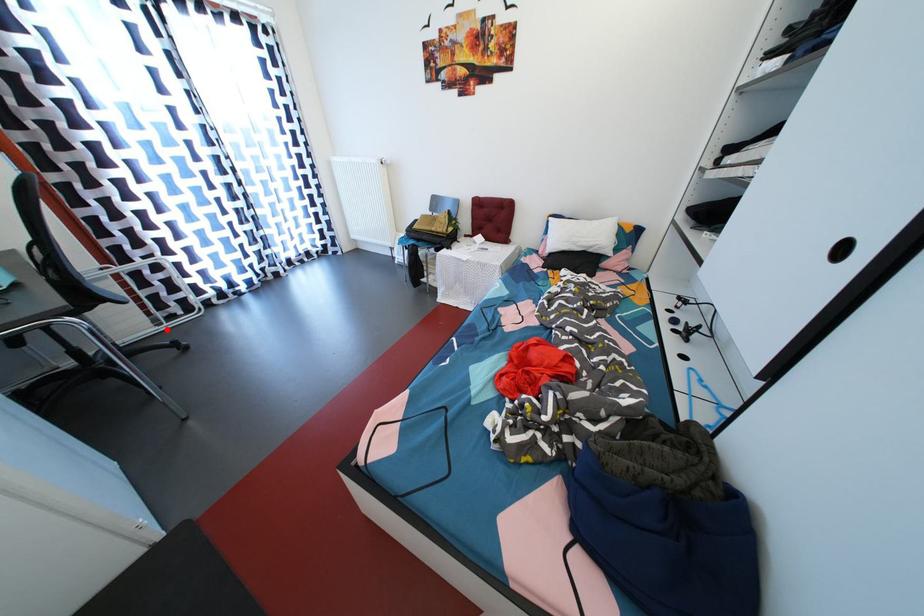
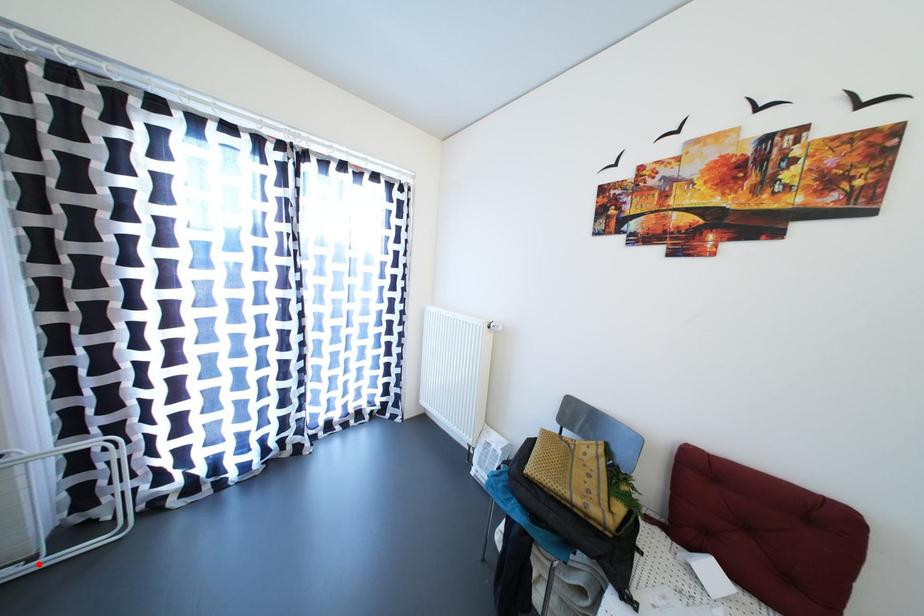
I am providing you with two images of the same scene from different viewpoints. A red point is marked on the first image and another point is marked on the second image. Is the red point in image1 aligned with the point shown in image2?

Yes